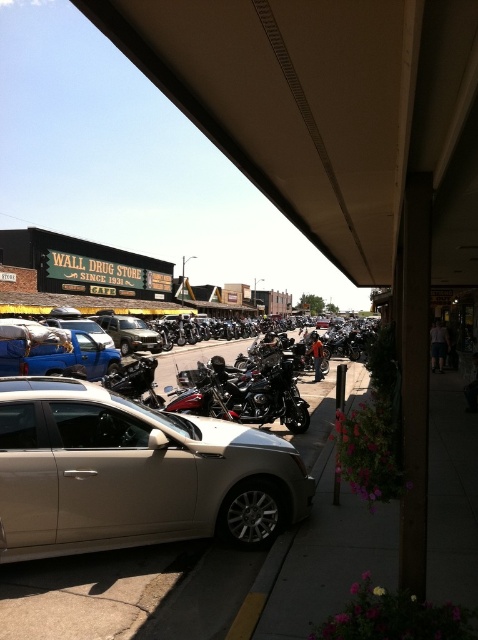
Question: Estimate the real-world distances between objects in this image. Which object is closer to the blue matte truck at left?

Choices:
 (A) satin silver sedan at center
 (B) shiny chrome motorcycle at center
 (C) matte silver sedan at center
 (D) matte blue truck at center-left

Answer: (B)

Question: Does satin silver sedan at center appear under shiny chrome motorcycle at center?

Choices:
 (A) no
 (B) yes

Answer: (B)

Question: Observing the image, what is the correct spatial positioning of shiny chrome motorcycle at center in reference to matte silver sedan at center?

Choices:
 (A) right
 (B) left

Answer: (A)

Question: Does satin silver sedan at center have a larger size compared to blue matte truck at left?

Choices:
 (A) no
 (B) yes

Answer: (B)

Question: Which object appears closest to the camera in this image?

Choices:
 (A) shiny chrome motorcycle at center
 (B) matte blue truck at center-left
 (C) blue matte truck at left

Answer: (A)

Question: Which object appears closest to the camera in this image?

Choices:
 (A) shiny chrome motorcycle at center
 (B) matte blue truck at center-left

Answer: (A)